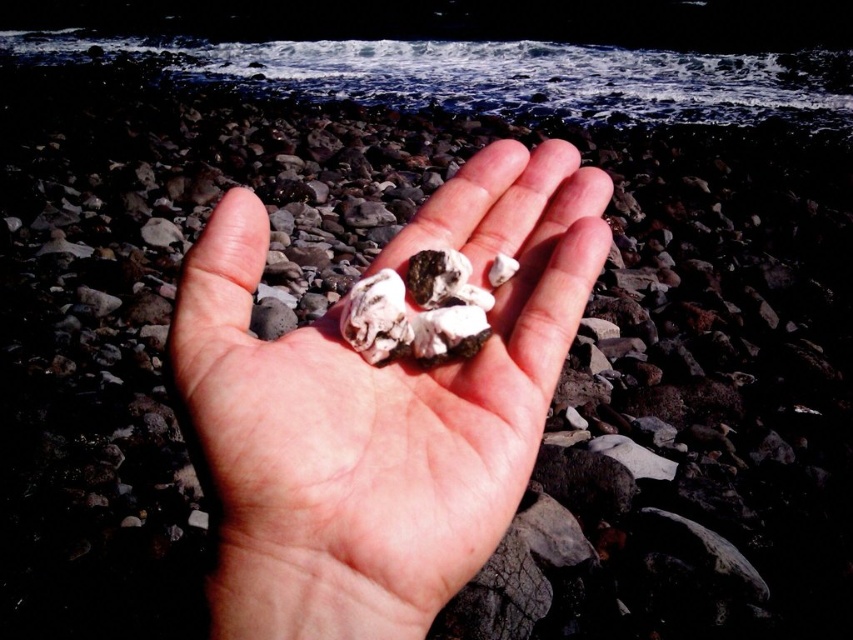
Question: Which object is farther from the camera taking this photo?

Choices:
 (A) white matte oyster at center
 (B) white matte rocks at center

Answer: (A)

Question: Is white matte rocks at center to the left of white matte oyster at center from the viewer's perspective?

Choices:
 (A) yes
 (B) no

Answer: (A)

Question: Where is white matte rocks at center located in relation to white matte oyster at center in the image?

Choices:
 (A) left
 (B) right

Answer: (A)

Question: Among these objects, which one is farthest from the camera?

Choices:
 (A) white matte oyster at center
 (B) white matte rocks at center

Answer: (A)

Question: Can you confirm if white matte rocks at center is wider than white matte oyster at center?

Choices:
 (A) no
 (B) yes

Answer: (B)